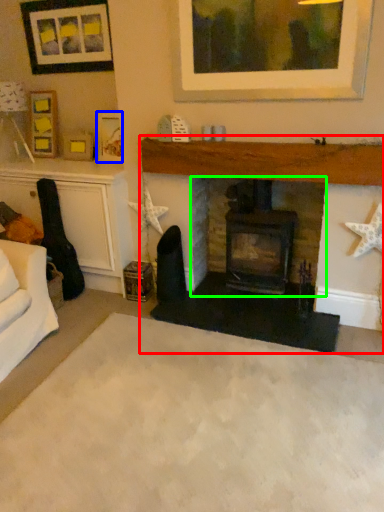
Question: Estimate the real-world distances between objects in this image. Which object is closer to fireplace (highlighted by a red box), picture frame (highlighted by a blue box) or fireplace (highlighted by a green box)?

Choices:
 (A) picture frame
 (B) fireplace

Answer: (B)